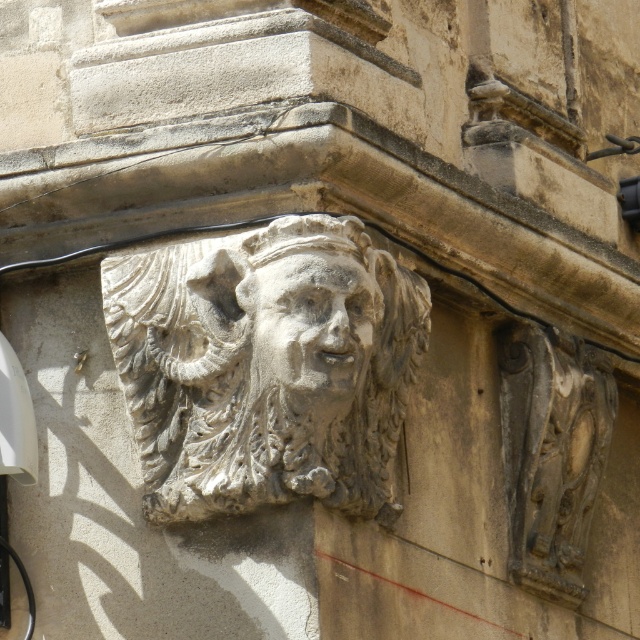
Question: Which of these objects is positioned closest to the gray stone face at center?

Choices:
 (A) carved stone mask at upper right
 (B) carved stone face at center

Answer: (B)

Question: Based on their relative distances, which object is nearer to the carved stone face at center?

Choices:
 (A) gray stone face at center
 (B) carved stone mask at upper right

Answer: (A)

Question: From the image, what is the correct spatial relationship of carved stone mask at upper right in relation to carved stone face at center?

Choices:
 (A) left
 (B) right

Answer: (B)

Question: Is gray stone face at center bigger than carved stone face at center?

Choices:
 (A) no
 (B) yes

Answer: (B)

Question: Is carved stone mask at upper right bigger than carved stone face at center?

Choices:
 (A) yes
 (B) no

Answer: (A)

Question: Which point is farther from the camera taking this photo?

Choices:
 (A) (340, 387)
 (B) (557, 584)
 (C) (352, 344)

Answer: (B)